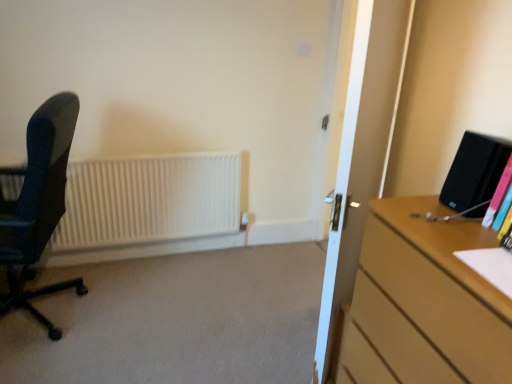
Where is `free region under matte black office chair at left (from a real-world perspective)`? The width and height of the screenshot is (512, 384). free region under matte black office chair at left (from a real-world perspective) is located at coordinates (45, 312).